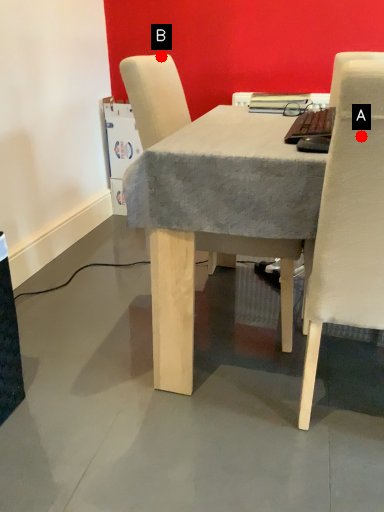
Question: Two points are circled on the image, labeled by A and B beside each circle. Which point appears farthest from the camera in this image?

Choices:
 (A) A is further
 (B) B is further

Answer: (B)